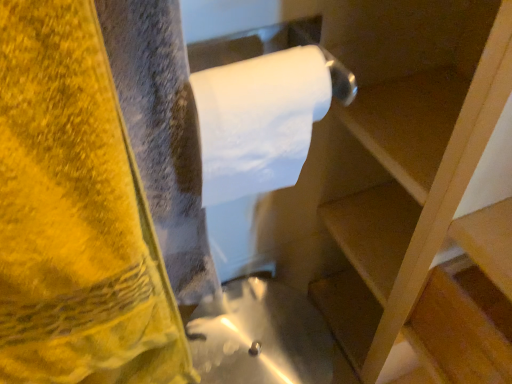
Question: From a real-world perspective, is yellow velvety towel at left located higher than white matte toilet paper at upper center?

Choices:
 (A) yes
 (B) no

Answer: (B)

Question: Does yellow velvety towel at left have a larger size compared to white matte toilet paper at upper center?

Choices:
 (A) yes
 (B) no

Answer: (A)

Question: Considering the relative positions of yellow velvety towel at left and white matte toilet paper at upper center in the image provided, is yellow velvety towel at left in front of white matte toilet paper at upper center?

Choices:
 (A) yes
 (B) no

Answer: (A)

Question: Are yellow velvety towel at left and white matte toilet paper at upper center located far from each other?

Choices:
 (A) no
 (B) yes

Answer: (A)

Question: Is yellow velvety towel at left oriented away from white matte toilet paper at upper center?

Choices:
 (A) no
 (B) yes

Answer: (A)

Question: Is white matte toilet paper at upper center inside or outside of wooden at upper right?

Choices:
 (A) outside
 (B) inside

Answer: (A)

Question: In terms of width, does white matte toilet paper at upper center look wider or thinner when compared to wooden at upper right?

Choices:
 (A) thin
 (B) wide

Answer: (A)

Question: From the image's perspective, is white matte toilet paper at upper center positioned above or below wooden at upper right?

Choices:
 (A) below
 (B) above

Answer: (B)

Question: From a real-world perspective, relative to wooden at upper right, is white matte toilet paper at upper center vertically above or below?

Choices:
 (A) above
 (B) below

Answer: (A)

Question: Considering the positions of yellow velvety towel at left and white matte toilet paper at upper center in the image, is yellow velvety towel at left wider or thinner than white matte toilet paper at upper center?

Choices:
 (A) thin
 (B) wide

Answer: (A)

Question: In terms of height, does yellow velvety towel at left look taller or shorter compared to white matte toilet paper at upper center?

Choices:
 (A) short
 (B) tall

Answer: (B)

Question: Is yellow velvety towel at left to the left or to the right of white matte toilet paper at upper center in the image?

Choices:
 (A) right
 (B) left

Answer: (B)

Question: Is yellow velvety towel at left inside or outside of white matte toilet paper at upper center?

Choices:
 (A) outside
 (B) inside

Answer: (A)

Question: From a real-world perspective, is white matte toilet paper at upper center positioned above or below yellow velvety towel at left?

Choices:
 (A) above
 (B) below

Answer: (A)

Question: From their relative heights in the image, would you say white matte toilet paper at upper center is taller or shorter than yellow velvety towel at left?

Choices:
 (A) short
 (B) tall

Answer: (A)